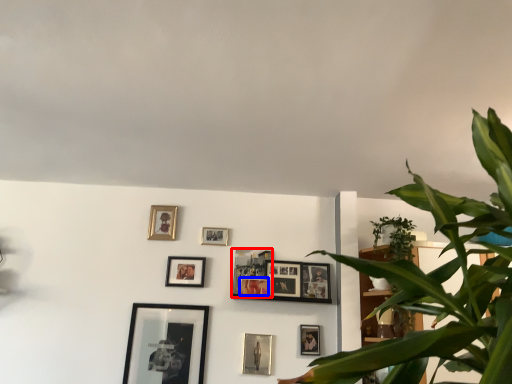
Question: Which object appears closest to the camera in this image, picture frame (highlighted by a red box) or picture frame (highlighted by a blue box)?

Choices:
 (A) picture frame
 (B) picture frame

Answer: (B)